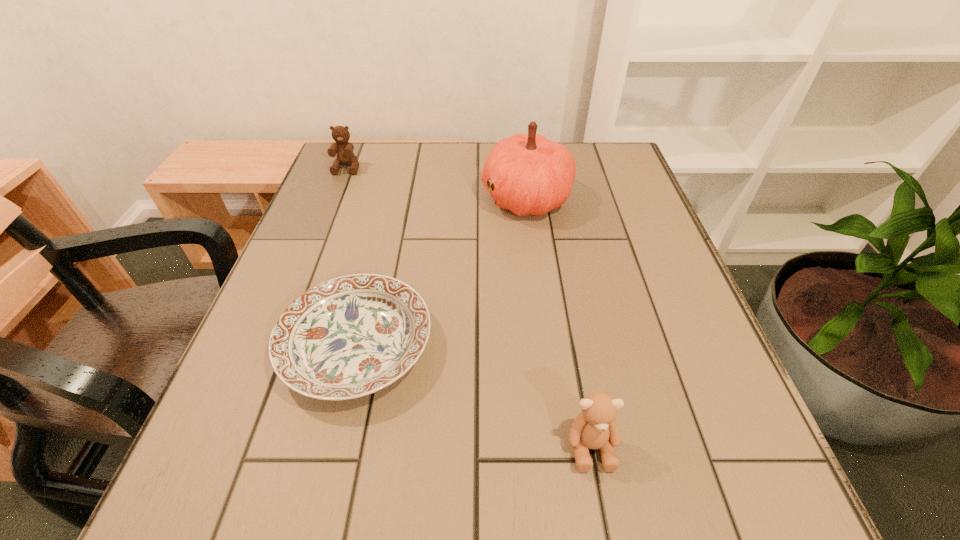
The width and height of the screenshot is (960, 540). Find the location of `vacant space located 0.160m on the front of the shortest object`. vacant space located 0.160m on the front of the shortest object is located at coordinates (313, 527).

This screenshot has width=960, height=540. Find the location of `pumpkin situated at the far edge`. pumpkin situated at the far edge is located at coordinates (532, 175).

The height and width of the screenshot is (540, 960). I want to click on teddy bear located at the far edge, so click(345, 156).

This screenshot has width=960, height=540. I want to click on object situated at the near edge, so click(x=595, y=428).

Where is `teddy bear located in the left edge section of the desktop`? This screenshot has height=540, width=960. teddy bear located in the left edge section of the desktop is located at coordinates (345, 156).

Where is `plate that is at the left edge`? This screenshot has width=960, height=540. plate that is at the left edge is located at coordinates (351, 336).

The image size is (960, 540). I want to click on object that is positioned at the far left corner, so 345,156.

Locate an element on the screen. blank space at the near edge is located at coordinates (640, 484).

You are a GUI agent. You are given a task and a screenshot of the screen. Output one action in this format:
    pyautogui.click(x=<x>, y=<y>)
    Task: Click on the vacant space at the left edge of the desktop
    This screenshot has width=960, height=540.
    Given the screenshot: What is the action you would take?
    point(222,396)

Locate an element on the screen. vacant space at the right edge of the desktop is located at coordinates (609, 212).